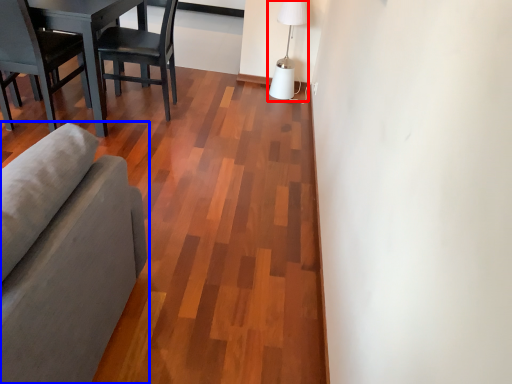
Question: Among these objects, which one is farthest to the camera, table lamp (highlighted by a red box) or studio couch (highlighted by a blue box)?

Choices:
 (A) table lamp
 (B) studio couch

Answer: (A)